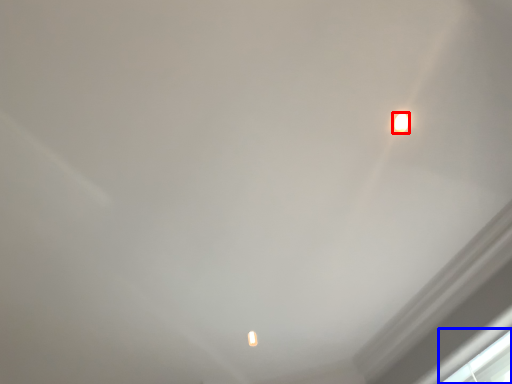
Question: Which object appears farthest to the camera in this image, lamp (highlighted by a red box) or window (highlighted by a blue box)?

Choices:
 (A) lamp
 (B) window

Answer: (B)